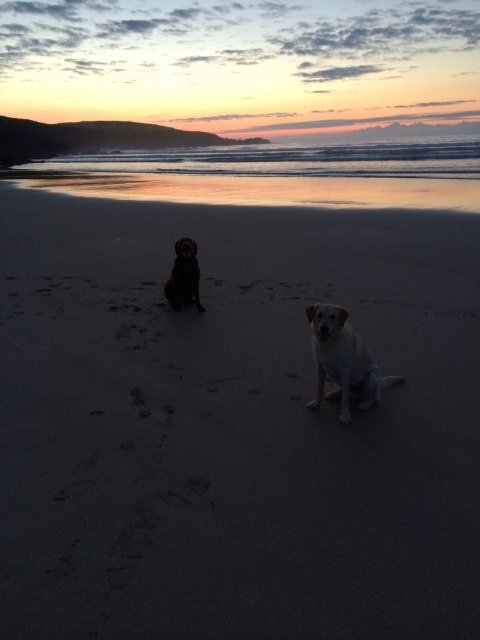
Is smooth sand at center shorter than shiny black dog at center?

In fact, smooth sand at center may be taller than shiny black dog at center.

Which is above, smooth sand at center or shiny black dog at center?

shiny black dog at center is above.

Is point (312, 490) farther from camera compared to point (186, 250)?

No.

Locate an element on the screen. smooth sand at center is located at coordinates (233, 424).

Which is behind, point (340, 380) or point (199, 269)?

The point (199, 269) is more distant.

Who is lower down, golden fur dog at center or shiny black dog at center?

golden fur dog at center is lower down.

What do you see at coordinates (343, 360) in the screenshot? Image resolution: width=480 pixels, height=640 pixels. I see `golden fur dog at center` at bounding box center [343, 360].

Locate an element on the screen. The image size is (480, 640). golden fur dog at center is located at coordinates (343, 360).

Can you confirm if smooth sand at center is positioned to the left of golden fur dog at center?

Correct, you'll find smooth sand at center to the left of golden fur dog at center.

Does point (97, 420) come farther from viewer compared to point (331, 365)?

No.

The width and height of the screenshot is (480, 640). What are the coordinates of `smooth sand at center` in the screenshot? It's located at 233,424.